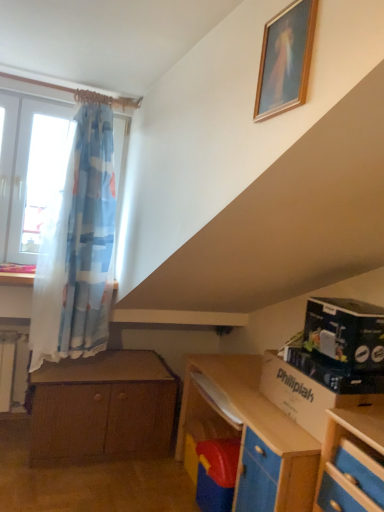
Question: Should I look upward or downward to see black cardboard box at right?

Choices:
 (A) up
 (B) down

Answer: (B)

Question: Considering the relative sizes of brown wooden chest of drawers at lower left and cardboard box at lower right in the image provided, is brown wooden chest of drawers at lower left taller than cardboard box at lower right?

Choices:
 (A) no
 (B) yes

Answer: (B)

Question: Is brown wooden chest of drawers at lower left positioned far away from cardboard box at lower right?

Choices:
 (A) no
 (B) yes

Answer: (B)

Question: Is cardboard box at lower right a part of brown wooden chest of drawers at lower left?

Choices:
 (A) no
 (B) yes

Answer: (A)

Question: Does brown wooden chest of drawers at lower left appear on the left side of cardboard box at lower right?

Choices:
 (A) yes
 (B) no

Answer: (A)

Question: Does brown wooden chest of drawers at lower left come in front of cardboard box at lower right?

Choices:
 (A) yes
 (B) no

Answer: (B)

Question: Is brown wooden chest of drawers at lower left positioned with its back to cardboard box at lower right?

Choices:
 (A) yes
 (B) no

Answer: (B)

Question: Can you confirm if black cardboard box at right is bigger than cardboard box at lower right?

Choices:
 (A) yes
 (B) no

Answer: (B)

Question: Is black cardboard box at right oriented towards cardboard box at lower right?

Choices:
 (A) yes
 (B) no

Answer: (B)

Question: Is black cardboard box at right looking in the opposite direction of cardboard box at lower right?

Choices:
 (A) no
 (B) yes

Answer: (A)

Question: Can you confirm if black cardboard box at right is shorter than cardboard box at lower right?

Choices:
 (A) yes
 (B) no

Answer: (B)

Question: Is black cardboard box at right closer to the viewer compared to cardboard box at lower right?

Choices:
 (A) yes
 (B) no

Answer: (B)

Question: Considering the relative positions of black cardboard box at right and cardboard box at lower right in the image provided, is black cardboard box at right to the left of cardboard box at lower right from the viewer's perspective?

Choices:
 (A) yes
 (B) no

Answer: (B)

Question: Is brown wooden chest of drawers at lower left in contact with black cardboard box at right?

Choices:
 (A) yes
 (B) no

Answer: (B)